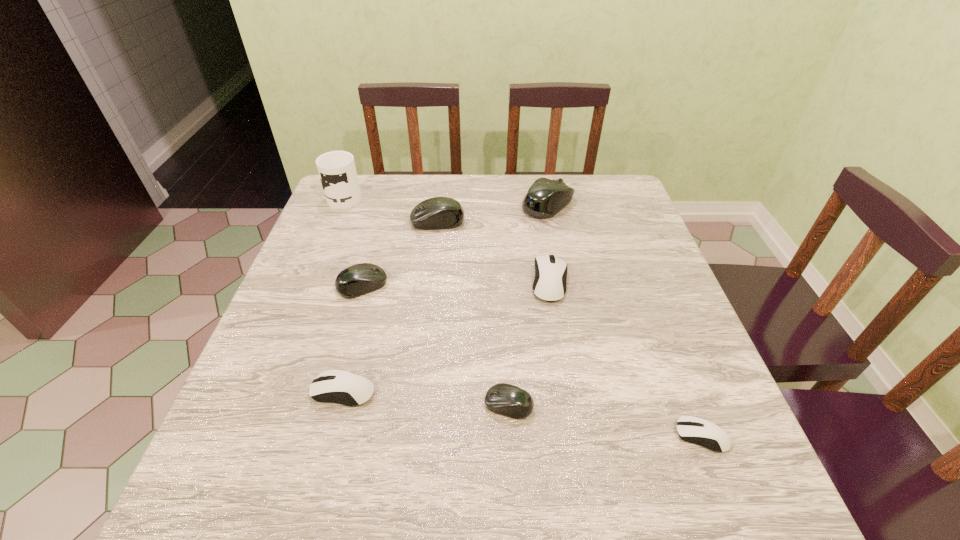
The width and height of the screenshot is (960, 540). Identify the location of free region located 0.140m on the right of the second nearest white mouse. (449, 391).

Find the location of a particular element. The height and width of the screenshot is (540, 960). free space located on the left of the third black mouse from left to right is located at coordinates (273, 405).

The image size is (960, 540). In order to click on free space located 0.270m on the left of the rightmost mouse in this screenshot , I will do `click(521, 436)`.

I want to click on mug located in the far edge section of the desktop, so click(337, 171).

Identify the location of mug at the left edge. (337, 171).

The height and width of the screenshot is (540, 960). I want to click on object that is positioned at the right edge, so click(x=692, y=429).

Find the location of a particular element. Image resolution: width=960 pixels, height=540 pixels. object at the far left corner is located at coordinates (337, 171).

Locate an element on the screen. vacant space at the far edge of the desktop is located at coordinates [x=501, y=205].

Find the location of `free space at the near edge of the desktop`. free space at the near edge of the desktop is located at coordinates click(x=363, y=521).

This screenshot has height=540, width=960. In the image, there is a desktop. In order to click on vacant space at the left edge in this screenshot , I will do `click(370, 227)`.